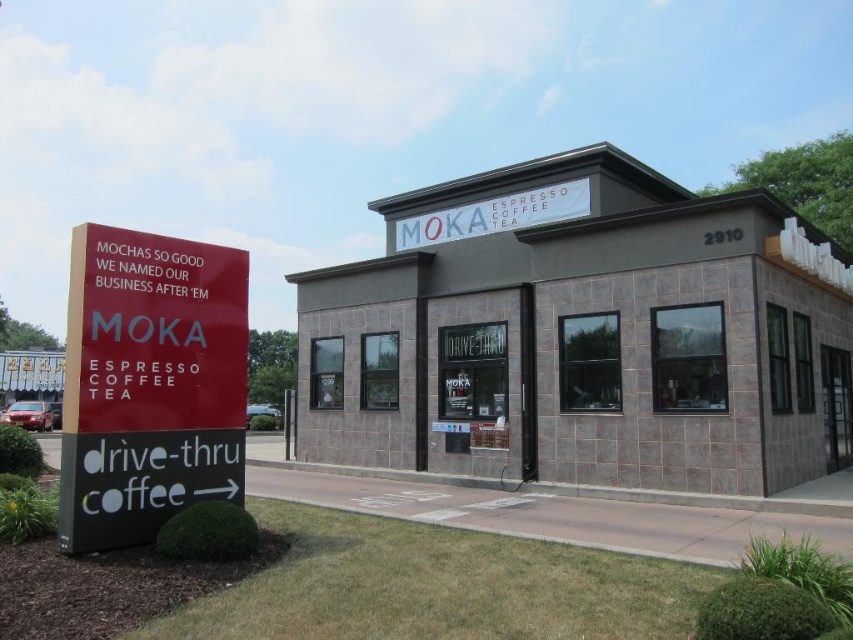
What is the relationship between the size of the gray stone building at center and the red matte sign at left?

The gray stone building at center is larger in size than the red matte sign at left.

You are standing in front of the gray stone building at center and want to hang a new sign. The new sign must be placed exactly 10 feet away from the building. Is the current white fabric sign at upper center in the way?

The gray stone building at center is 7.68 feet from the white fabric sign at upper center. Since the new sign needs to be placed 10 feet away from the building, the existing white fabric sign at upper center is within that distance and would be in the way.